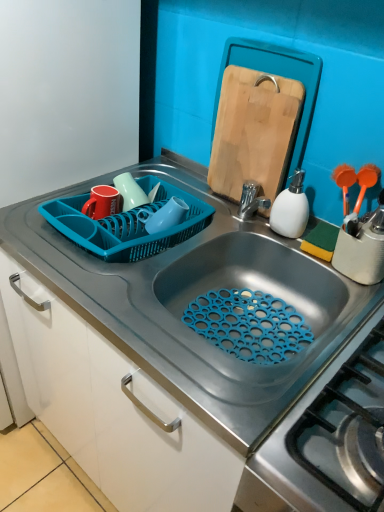
Where is `vacant space situated on the left part of white matte soap dispenser at right`? This screenshot has height=512, width=384. vacant space situated on the left part of white matte soap dispenser at right is located at coordinates (223, 233).